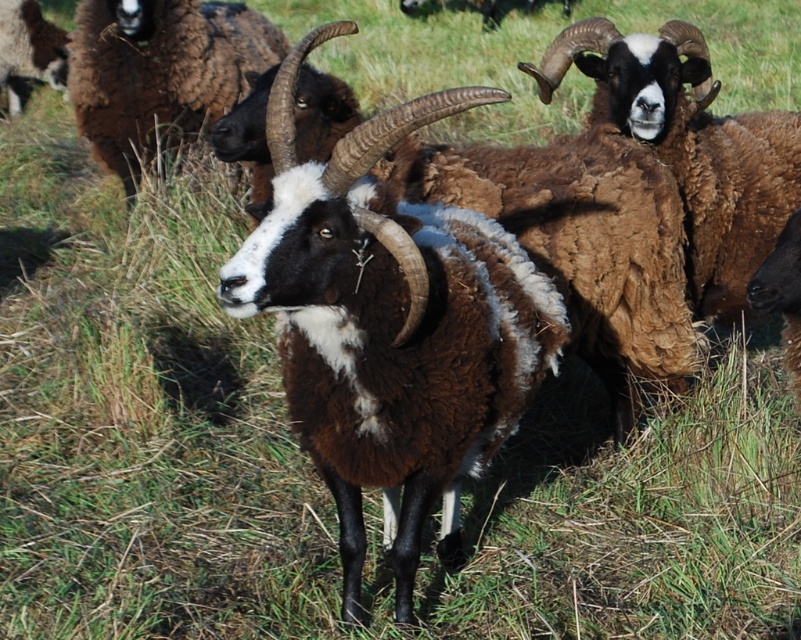
You are a farmer checking the field. You notice the brown woolly ram at upper right and the brown woolen sheep at upper left. Which one takes up more space in the image?

The brown woolen sheep at upper left takes up more space in the image than the brown woolly ram at upper right because the brown woolly ram at upper right occupies less space than brown woolen sheep at upper left.

You are standing in the field looking at the sheep. There are two points marked in the image, point 1 at coordinates (546, 86) and point 2 at (10, 36). Which point is closer to you?

Point 1 at coordinates (546, 86) is closer to the viewer than point 2 at (10, 36).

You are a farmer assessing the space needed for your animals. You have a 1.8 meter wide gate. The brown woolly goat at upper left and brown woolen sheep at upper left are both trying to pass through it. Which animal is more likely to fit through the gate without any adjustments?

The brown woolen sheep at upper left is more likely to fit through the 1.8 meter wide gate since its width is narrower than the brown woolly goat at upper left, which is wider.